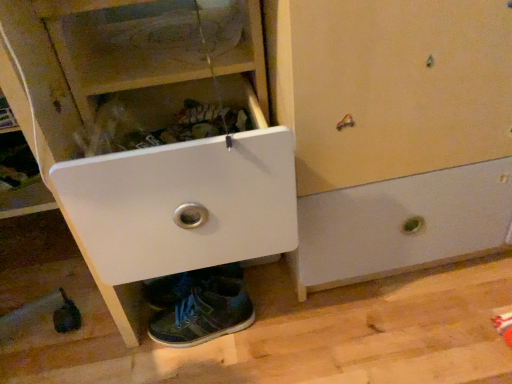
Find the location of a particular element. The image size is (512, 384). vacant space situated on the left part of green suede shoes at lower center is located at coordinates [114, 342].